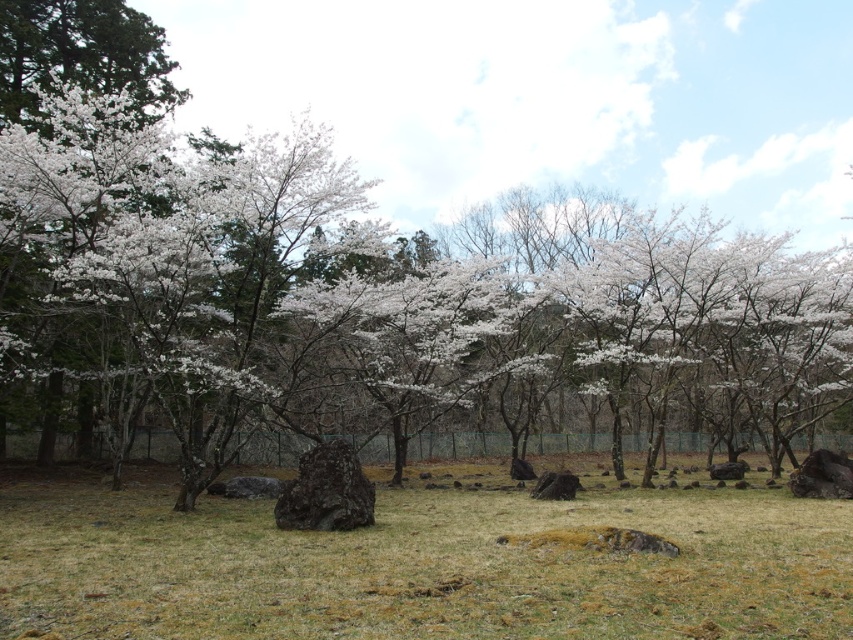
You are a gardener trying to plant a new flower in the brown grass at center. You notice the white blossoms at center above it. Will the new flower receive enough sunlight if planted there?

The brown grass at center is positioned under white blossoms at center, so the area might be shaded by the blossoms, potentially limiting sunlight for the new flower.

You are standing in the cherry blossom grove and see two points marked on the ground. The first point is at coordinate point [636,509] and the second is at point [241,349]. If you want to reach the closer point to you first, which coordinate should you head towards?

You should head towards point [241,349] because it is closer to you than point [636,509].

You are standing at the point marked as point (418, 564) in the image. What is the color of the ground at that exact location?

The ground at point (418, 564) is brown grass at center.